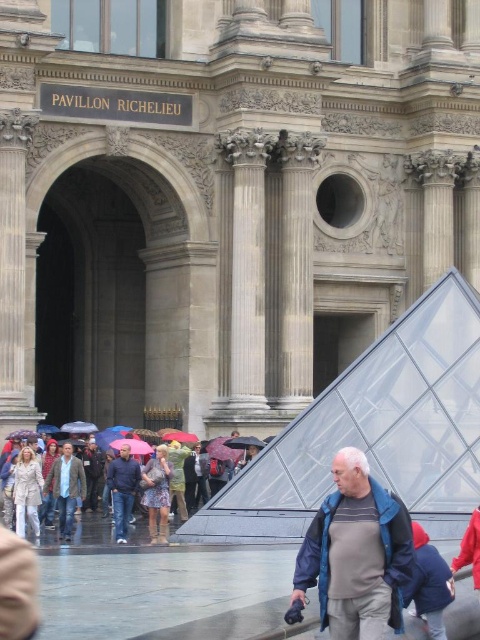
You are a photographer standing at the entrance of the Pavillon Richelieu. You see a gray fabric jacket at lower right and a floral dress at center. Which clothing item is narrower?

The gray fabric jacket at lower right is narrower than the floral dress at center.

You are a visitor at the Louvre Museum and notice two items in the scene. The gray fabric jacket at lower right and the floral dress at center. Which item is shorter in height?

The gray fabric jacket at lower right is shorter than the floral dress at center.